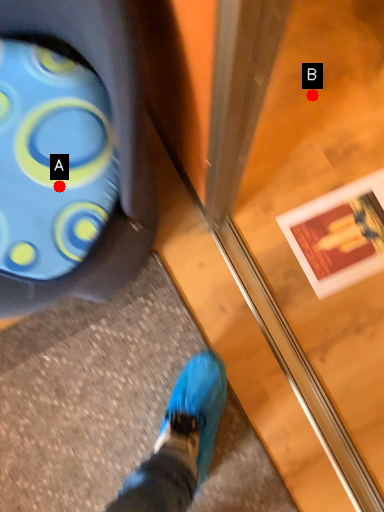
Question: Two points are circled on the image, labeled by A and B beside each circle. Which point appears closest to the camera in this image?

Choices:
 (A) A is closer
 (B) B is closer

Answer: (A)